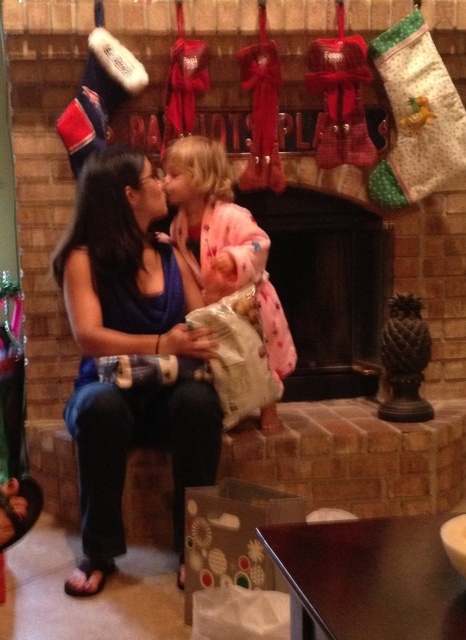
Question: Is blue fabric shirt at center below pink fuzzy robe at center?

Choices:
 (A) yes
 (B) no

Answer: (A)

Question: Which of these objects is positioned farthest from the blue fabric shirt at center?

Choices:
 (A) black matte fireplace at center
 (B) pink fuzzy robe at center

Answer: (A)

Question: Considering the real-world distances, which object is closest to the pink fuzzy robe at center?

Choices:
 (A) blue fabric shirt at center
 (B) black matte fireplace at center

Answer: (A)

Question: Does black matte fireplace at center have a greater width compared to pink fuzzy robe at center?

Choices:
 (A) no
 (B) yes

Answer: (B)

Question: Is black matte fireplace at center bigger than pink fuzzy robe at center?

Choices:
 (A) yes
 (B) no

Answer: (B)

Question: Which of the following is the farthest from the observer?

Choices:
 (A) (198, 232)
 (B) (173, 490)

Answer: (A)